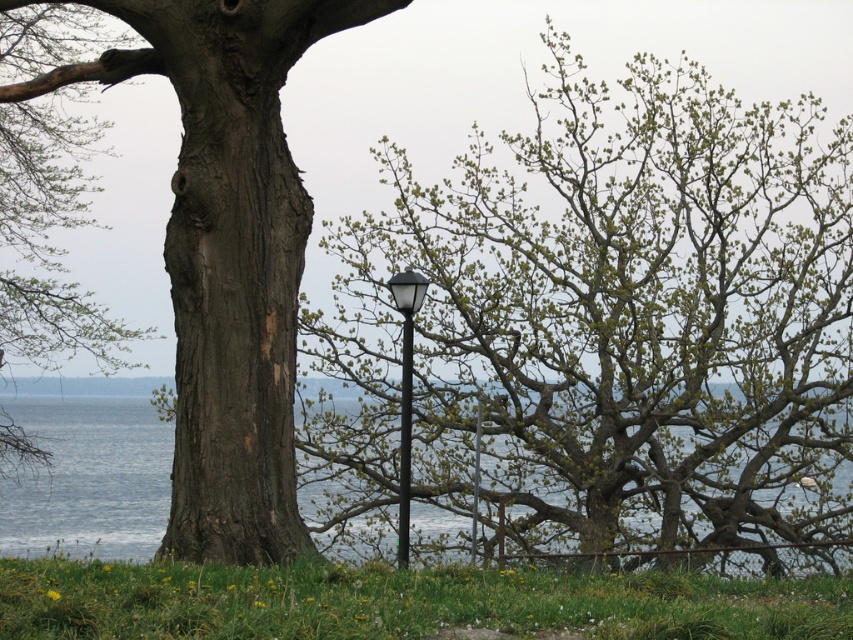
Question: Considering the relative positions of green leafy tree at center and black glass street light at center in the image provided, where is green leafy tree at center located with respect to black glass street light at center?

Choices:
 (A) below
 (B) above

Answer: (B)

Question: Observing the image, what is the correct spatial positioning of blue water at lower left in reference to black glass street light at center?

Choices:
 (A) above
 (B) below

Answer: (B)

Question: Among these points, which one is farthest from the camera?

Choices:
 (A) (257, 374)
 (B) (94, 122)
 (C) (119, 422)

Answer: (B)

Question: Which object is the farthest from the black glass street light at center?

Choices:
 (A) green leafy tree at center
 (B) blue water at lower left
 (C) smooth bark tree at center
 (D) smooth brown tree trunk at left

Answer: (B)

Question: Considering the real-world distances, which object is closest to the blue water at lower left?

Choices:
 (A) green leafy tree at center
 (B) smooth brown tree trunk at left

Answer: (B)

Question: Does smooth brown tree trunk at left appear on the left side of black glass street light at center?

Choices:
 (A) yes
 (B) no

Answer: (A)